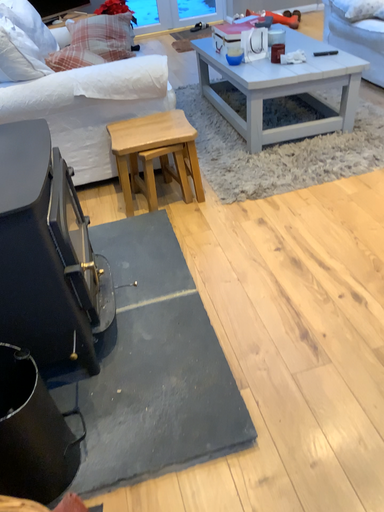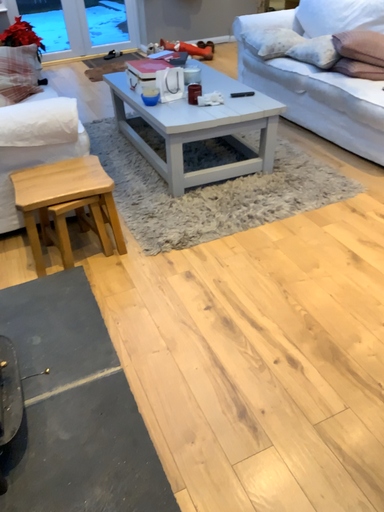
Question: Which way did the camera rotate in the video?

Choices:
 (A) rotated left
 (B) rotated right

Answer: (B)